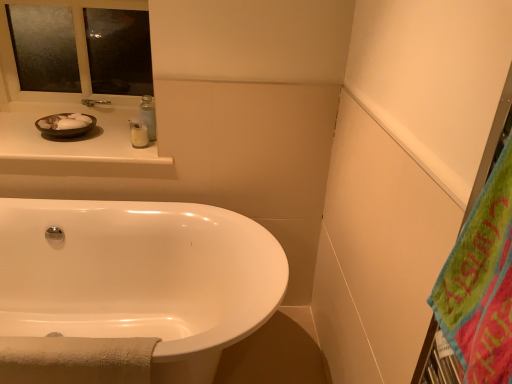
Question: Is green fuzzy beach towel at right positioned in front of matte white counter at upper left?

Choices:
 (A) yes
 (B) no

Answer: (A)

Question: Can you see green fuzzy beach towel at right touching matte white counter at upper left?

Choices:
 (A) yes
 (B) no

Answer: (B)

Question: Is green fuzzy beach towel at right further to camera compared to matte white counter at upper left?

Choices:
 (A) yes
 (B) no

Answer: (B)

Question: From the image's perspective, is green fuzzy beach towel at right located above matte white counter at upper left?

Choices:
 (A) yes
 (B) no

Answer: (B)

Question: Can you confirm if green fuzzy beach towel at right is positioned to the right of matte white counter at upper left?

Choices:
 (A) no
 (B) yes

Answer: (B)

Question: In the image, is white glossy lotion at upper center positioned in front of or behind matte white counter at upper left?

Choices:
 (A) behind
 (B) front

Answer: (A)

Question: Is white glossy lotion at upper center taller or shorter than matte white counter at upper left?

Choices:
 (A) tall
 (B) short

Answer: (A)

Question: Looking at their shapes, would you say white glossy lotion at upper center is wider or thinner than matte white counter at upper left?

Choices:
 (A) wide
 (B) thin

Answer: (B)

Question: Is white glossy lotion at upper center inside or outside of matte white counter at upper left?

Choices:
 (A) inside
 (B) outside

Answer: (B)

Question: Considering the positions of white glossy bathtub at lower left and white glossy lotion at upper center in the image, is white glossy bathtub at lower left bigger or smaller than white glossy lotion at upper center?

Choices:
 (A) big
 (B) small

Answer: (A)

Question: Considering the positions of white glossy bathtub at lower left and white glossy lotion at upper center in the image, is white glossy bathtub at lower left wider or thinner than white glossy lotion at upper center?

Choices:
 (A) thin
 (B) wide

Answer: (B)

Question: From the image's perspective, is white glossy bathtub at lower left above or below white glossy lotion at upper center?

Choices:
 (A) below
 (B) above

Answer: (A)

Question: Would you say white glossy bathtub at lower left is inside or outside white glossy lotion at upper center?

Choices:
 (A) inside
 (B) outside

Answer: (B)

Question: From their relative heights in the image, would you say frosted glass mirror at upper left is taller or shorter than white glossy bathtub at lower left?

Choices:
 (A) short
 (B) tall

Answer: (A)

Question: From a real-world perspective, is frosted glass mirror at upper left positioned above or below white glossy bathtub at lower left?

Choices:
 (A) below
 (B) above

Answer: (B)